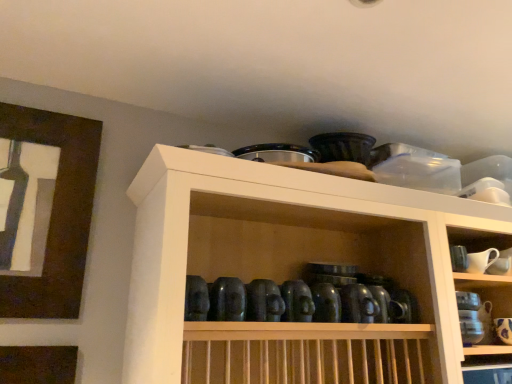
Image resolution: width=512 pixels, height=384 pixels. Describe the element at coordinates (481, 260) in the screenshot. I see `white ceramic pitcher at upper right, the second tableware from the bottom` at that location.

Find the location of `white ceramic pitcher at upper right, the second tableware from the bottom`. white ceramic pitcher at upper right, the second tableware from the bottom is located at coordinates (481, 260).

Where is `brown wooden picture frame at upper left`? brown wooden picture frame at upper left is located at coordinates (56, 212).

You are a GUI agent. You are given a task and a screenshot of the screen. Output one action in this format:
    pyautogui.click(x=<x>, y=<y>)
    Task: Click on the white glossy mug at upper right, the 2th tableware positioned from the left
    
    Given the screenshot: What is the action you would take?
    pyautogui.click(x=504, y=329)

Considering their positions, is brown wooden picture frame at upper left located in front of or behind matte black bowls at upper center?

In the image, brown wooden picture frame at upper left appears behind matte black bowls at upper center.

Between brown wooden picture frame at upper left and matte black bowls at upper center, which one has smaller size?

brown wooden picture frame at upper left.

From the image's perspective, would you say brown wooden picture frame at upper left is shown under matte black bowls at upper center?

No, from the image's perspective, brown wooden picture frame at upper left is not beneath matte black bowls at upper center.

Find the location of a particular element. This screenshot has width=512, height=384. tableware above the white glossy mug at upper right, the first tableware when ordered from right to left (from the image's perspective) is located at coordinates (481, 260).

From the picture: Is white glossy mug at upper right, marked as the second tableware in a top-to-bottom arrangement, aimed at white ceramic pitcher at upper right, which is counted as the 2th tableware, starting from the right?

No, white glossy mug at upper right, marked as the second tableware in a top-to-bottom arrangement, is not facing towards white ceramic pitcher at upper right, which is counted as the 2th tableware, starting from the right.

Consider the image. Is white glossy mug at upper right, marked as the second tableware in a top-to-bottom arrangement, inside the boundaries of white ceramic pitcher at upper right, the second tableware from the bottom, or outside?

white glossy mug at upper right, marked as the second tableware in a top-to-bottom arrangement, is spatially situated outside white ceramic pitcher at upper right, the second tableware from the bottom.

From a real-world perspective, who is located lower, brown wooden picture frame at upper left or white ceramic pitcher at upper right, which is counted as the 1th tableware, starting from the left?

white ceramic pitcher at upper right, which is counted as the 1th tableware, starting from the left, from a real-world perspective.

Is the position of brown wooden picture frame at upper left more distant than that of white ceramic pitcher at upper right, which is counted as the 1th tableware, starting from the left?

No, brown wooden picture frame at upper left is closer to the viewer.

Does brown wooden picture frame at upper left have a greater height compared to white ceramic pitcher at upper right, the first tableware viewed from the top?

Yes, brown wooden picture frame at upper left is taller than white ceramic pitcher at upper right, the first tableware viewed from the top.

Find the location of a particular element. the 1st tableware behind the brown wooden picture frame at upper left is located at coordinates (481, 260).

Between matte black bowls at upper center and white glossy mug at upper right, the 2th tableware positioned from the left, which one appears on the right side from the viewer's perspective?

white glossy mug at upper right, the 2th tableware positioned from the left, is more to the right.

Considering the positions of points (458, 338) and (509, 342), is point (458, 338) farther from camera compared to point (509, 342)?

No, it is not.

Between matte black bowls at upper center and white glossy mug at upper right, the 1th tableware in the bottom-to-top sequence, which one has larger size?

matte black bowls at upper center is bigger.

Can you tell me how much matte black bowls at upper center and white glossy mug at upper right, marked as the second tableware in a top-to-bottom arrangement, differ in facing direction?

The angular difference between matte black bowls at upper center and white glossy mug at upper right, marked as the second tableware in a top-to-bottom arrangement, is 6.86 degrees.

Is brown wooden picture frame at upper left in front of white glossy mug at upper right, the 2th tableware positioned from the left?

Yes, it is.

Are brown wooden picture frame at upper left and white glossy mug at upper right, the first tableware when ordered from right to left, far apart?

brown wooden picture frame at upper left is far away from white glossy mug at upper right, the first tableware when ordered from right to left.

Where is `picture frame lying in front of the white glossy mug at upper right, the 2th tableware positioned from the left`? The height and width of the screenshot is (384, 512). picture frame lying in front of the white glossy mug at upper right, the 2th tableware positioned from the left is located at coordinates (56, 212).

Based on the photo, between brown wooden picture frame at upper left and white glossy mug at upper right, the 1th tableware in the bottom-to-top sequence, which one has smaller width?

With smaller width is brown wooden picture frame at upper left.

Does white ceramic pitcher at upper right, which is counted as the 2th tableware, starting from the right, have a lesser width compared to brown wooden picture frame at upper left?

No.

Is white ceramic pitcher at upper right, the first tableware viewed from the top, oriented towards brown wooden picture frame at upper left?

No, white ceramic pitcher at upper right, the first tableware viewed from the top, is not oriented towards brown wooden picture frame at upper left.

Can you tell me how much white ceramic pitcher at upper right, which is counted as the 1th tableware, starting from the left, and brown wooden picture frame at upper left differ in facing direction?

white ceramic pitcher at upper right, which is counted as the 1th tableware, starting from the left, and brown wooden picture frame at upper left are facing 0.919 degrees away from each other.

Locate an element on the screen. Image resolution: width=512 pixels, height=384 pixels. the 1st tableware positioned below the brown wooden picture frame at upper left (from a real-world perspective) is located at coordinates (481, 260).

Locate an element on the screen. The height and width of the screenshot is (384, 512). shelf that appears on the right of brown wooden picture frame at upper left is located at coordinates (292, 266).

Based on the photo, is matte black bowls at upper center not near brown wooden picture frame at upper left?

No, matte black bowls at upper center is not far from brown wooden picture frame at upper left.

From the picture: Between matte black bowls at upper center and brown wooden picture frame at upper left, which one has smaller size?

brown wooden picture frame at upper left is smaller.

From the image's perspective, which one is positioned higher, matte black bowls at upper center or brown wooden picture frame at upper left?

brown wooden picture frame at upper left appears higher in the image.

The image size is (512, 384). I want to click on shelf directly beneath the brown wooden picture frame at upper left (from a real-world perspective), so click(292, 266).

Where is `tableware located above the white glossy mug at upper right, marked as the second tableware in a top-to-bottom arrangement (from a real-world perspective)`? tableware located above the white glossy mug at upper right, marked as the second tableware in a top-to-bottom arrangement (from a real-world perspective) is located at coordinates (481, 260).

From the image, which object appears to be farther from matte black bowls at upper center, white glossy mug at upper right, the 1th tableware in the bottom-to-top sequence, or white ceramic pitcher at upper right, the first tableware viewed from the top?

Based on the image, white glossy mug at upper right, the 1th tableware in the bottom-to-top sequence, appears to be further to matte black bowls at upper center.

Based on their spatial positions, is white glossy mug at upper right, marked as the second tableware in a top-to-bottom arrangement, or brown wooden picture frame at upper left further from white ceramic pitcher at upper right, which is counted as the 1th tableware, starting from the left?

→ brown wooden picture frame at upper left is positioned further to the anchor white ceramic pitcher at upper right, which is counted as the 1th tableware, starting from the left.

Considering their positions, is matte black bowls at upper center positioned further to white glossy mug at upper right, the first tableware when ordered from right to left, than white ceramic pitcher at upper right, which is counted as the 2th tableware, starting from the right?

The object further to white glossy mug at upper right, the first tableware when ordered from right to left, is matte black bowls at upper center.

Estimate the real-world distances between objects in this image. Which object is further from brown wooden picture frame at upper left, matte black bowls at upper center or white ceramic pitcher at upper right, which is counted as the 2th tableware, starting from the right?

white ceramic pitcher at upper right, which is counted as the 2th tableware, starting from the right.

From the image, which object appears to be farther from white ceramic pitcher at upper right, the first tableware viewed from the top, matte black bowls at upper center or white glossy mug at upper right, the 2th tableware positioned from the left?

matte black bowls at upper center is positioned further to the anchor white ceramic pitcher at upper right, the first tableware viewed from the top.

In the scene shown: Which object lies nearer to the anchor point white ceramic pitcher at upper right, which is counted as the 1th tableware, starting from the left, matte black bowls at upper center or brown wooden picture frame at upper left?

The object closer to white ceramic pitcher at upper right, which is counted as the 1th tableware, starting from the left, is matte black bowls at upper center.

From the image, which object appears to be nearer to white glossy mug at upper right, the first tableware when ordered from right to left, white ceramic pitcher at upper right, which is counted as the 2th tableware, starting from the right, or brown wooden picture frame at upper left?

white ceramic pitcher at upper right, which is counted as the 2th tableware, starting from the right, lies closer to white glossy mug at upper right, the first tableware when ordered from right to left, than the other object.

When comparing their distances from matte black bowls at upper center, does brown wooden picture frame at upper left or white ceramic pitcher at upper right, which is counted as the 2th tableware, starting from the right, seem further?

white ceramic pitcher at upper right, which is counted as the 2th tableware, starting from the right, lies further to matte black bowls at upper center than the other object.

At what (x,y) coordinates should I click in order to perform the action: click on tableware between brown wooden picture frame at upper left and white glossy mug at upper right, the 2th tableware positioned from the left, from left to right. Please return your answer as a coordinate pair (x, y). The height and width of the screenshot is (384, 512). Looking at the image, I should click on (481, 260).

You are a GUI agent. You are given a task and a screenshot of the screen. Output one action in this format:
    pyautogui.click(x=<x>, y=<y>)
    Task: Click on the tableware positioned between matte black bowls at upper center and white glossy mug at upper right, the 1th tableware in the bottom-to-top sequence, from near to far
    
    Given the screenshot: What is the action you would take?
    tap(481, 260)

The width and height of the screenshot is (512, 384). I want to click on shelf situated between brown wooden picture frame at upper left and white glossy mug at upper right, the 2th tableware positioned from the left, from left to right, so click(x=292, y=266).

Image resolution: width=512 pixels, height=384 pixels. Identify the location of shelf between brown wooden picture frame at upper left and white ceramic pitcher at upper right, which is counted as the 2th tableware, starting from the right, from left to right. (292, 266).